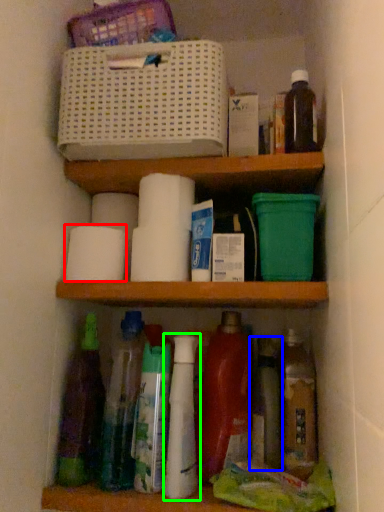
Question: Estimate the real-world distances between objects in this image. Which object is farther from toilet paper (highlighted by a red box), bottle (highlighted by a blue box) or bottle (highlighted by a green box)?

Choices:
 (A) bottle
 (B) bottle

Answer: (A)